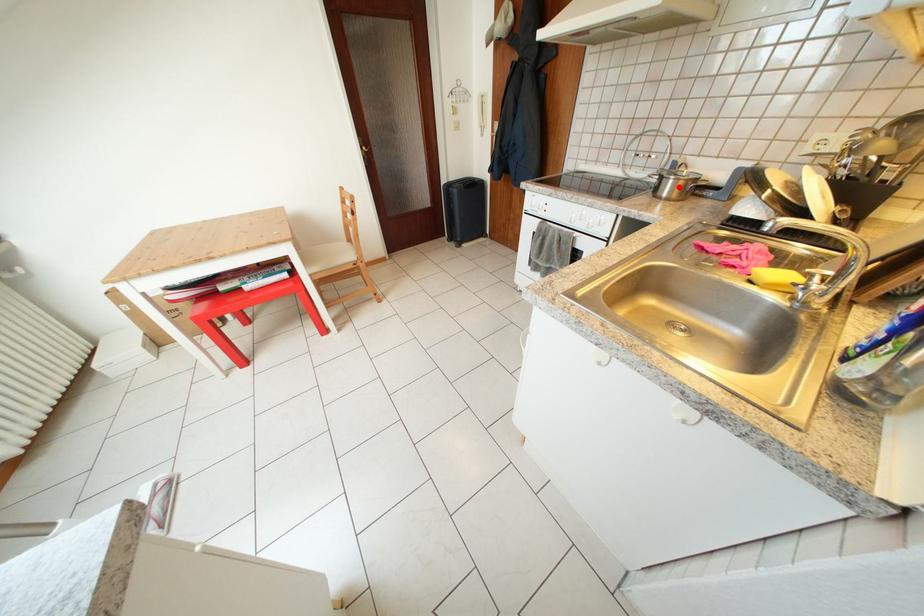
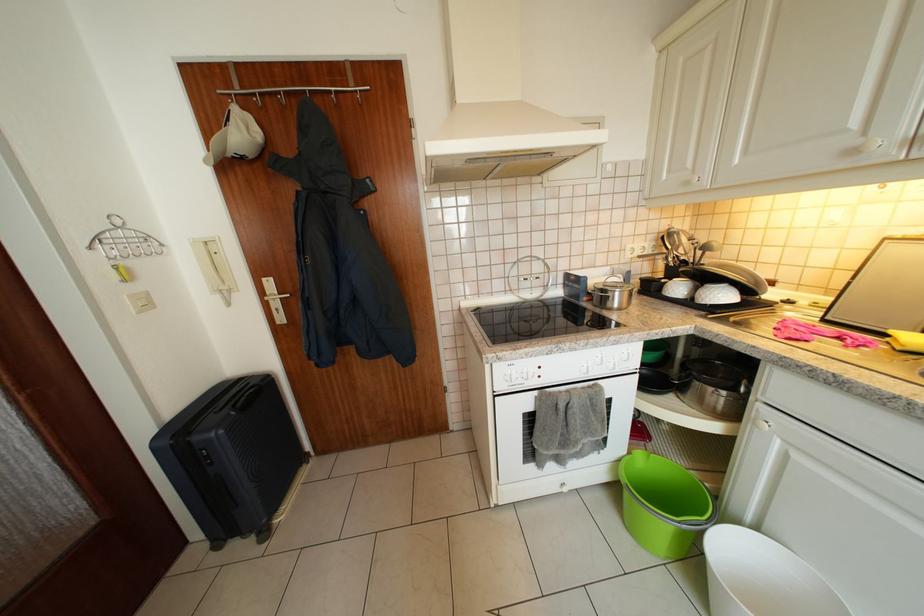
Where in the second image is the point corresponding to the highlighted location from the first image?

(626, 299)